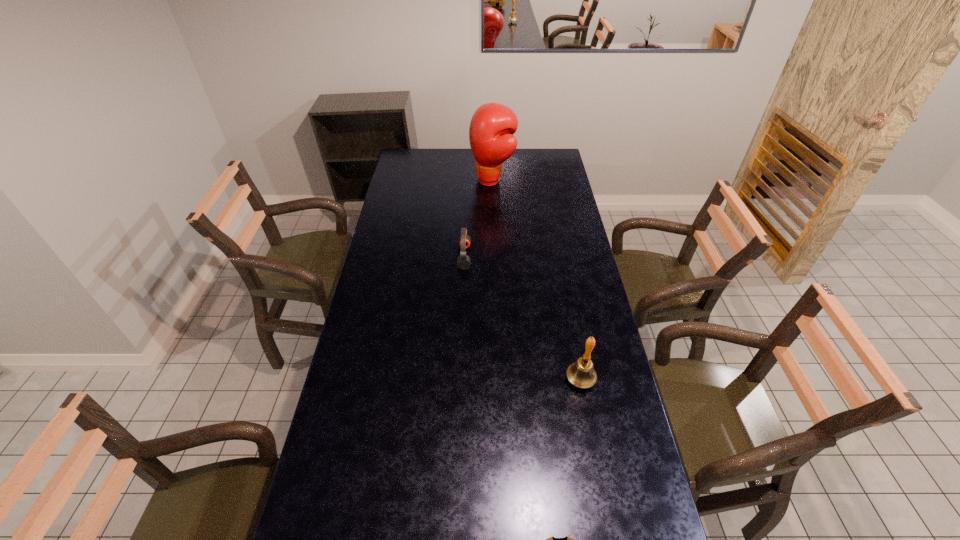
Locate an element on the screen. boxing glove is located at coordinates (492, 126).

Identify the location of the farthest object. (492, 126).

At what (x,y) coordinates should I click in order to perform the action: click on the third farthest object. Please return your answer as a coordinate pair (x, y). The height and width of the screenshot is (540, 960). Looking at the image, I should click on (581, 374).

Find the location of a particular element. the rightmost object is located at coordinates (581, 374).

The width and height of the screenshot is (960, 540). Identify the location of the third nearest object. (464, 241).

I want to click on earphone, so click(x=464, y=241).

The width and height of the screenshot is (960, 540). I want to click on vacant space located 0.160m on the striking surface of the boxing glove, so click(440, 180).

I want to click on vacant area located 0.250m on the striking surface of the boxing glove, so click(422, 180).

Where is `blank area located on the striking surface of the boxing glove`? This screenshot has width=960, height=540. blank area located on the striking surface of the boxing glove is located at coordinates (453, 180).

Locate an element on the screen. vacant space situated 0.200m on the back of the rightmost object is located at coordinates (569, 321).